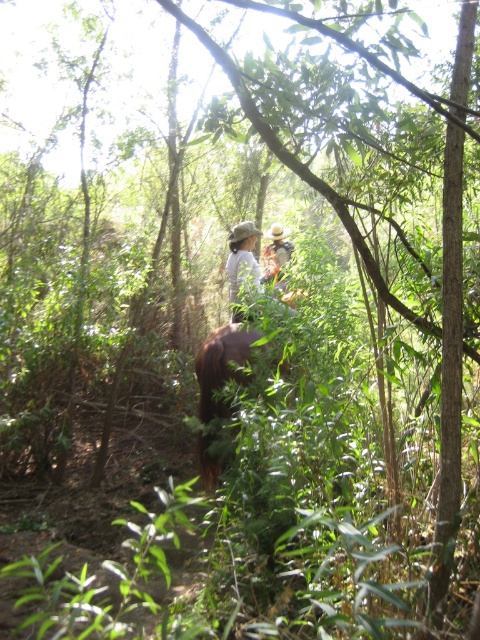
Is brown furry horse at center below wooden hat at center?

Yes, brown furry horse at center is below wooden hat at center.

Who is more forward, (243, 330) or (264, 268)?

Positioned in front is point (243, 330).

The width and height of the screenshot is (480, 640). In order to click on brown furry horse at center in this screenshot , I will do `click(222, 364)`.

Identify the location of brown furry horse at center. Image resolution: width=480 pixels, height=640 pixels. (222, 364).

Is light brown fabric at center to the left of wooden hat at center from the viewer's perspective?

Yes, light brown fabric at center is to the left of wooden hat at center.

Is light brown fabric at center bigger than wooden hat at center?

Yes, light brown fabric at center is bigger than wooden hat at center.

Between point (279, 252) and point (268, 244), which one is positioned behind?

Positioned behind is point (268, 244).

I want to click on light brown fabric at center, so click(x=253, y=256).

Does brown furry horse at center appear on the right side of light brown fabric at center?

No, brown furry horse at center is not to the right of light brown fabric at center.

Is point (215, 333) positioned after point (245, 234)?

That is False.

Find the location of a particular element. brown furry horse at center is located at coordinates (222, 364).